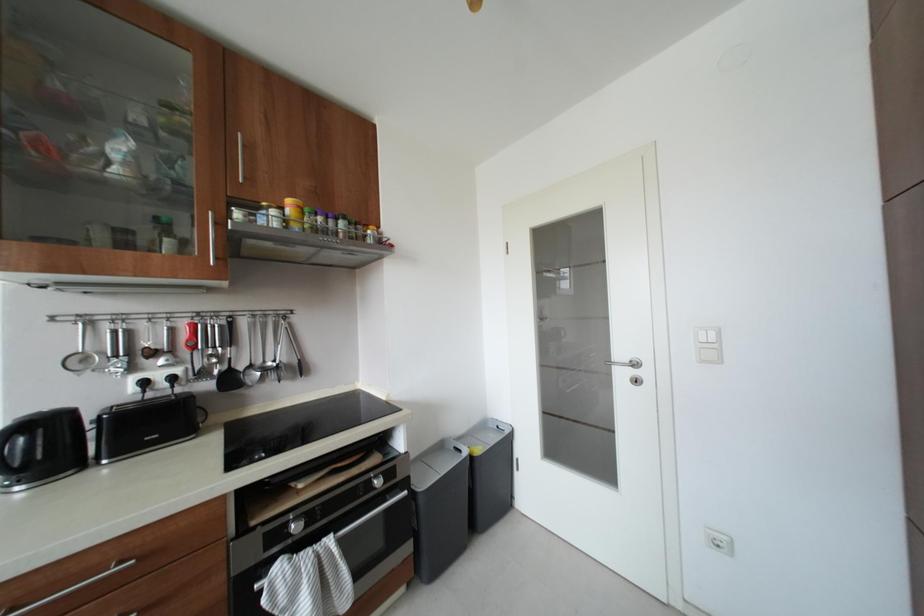
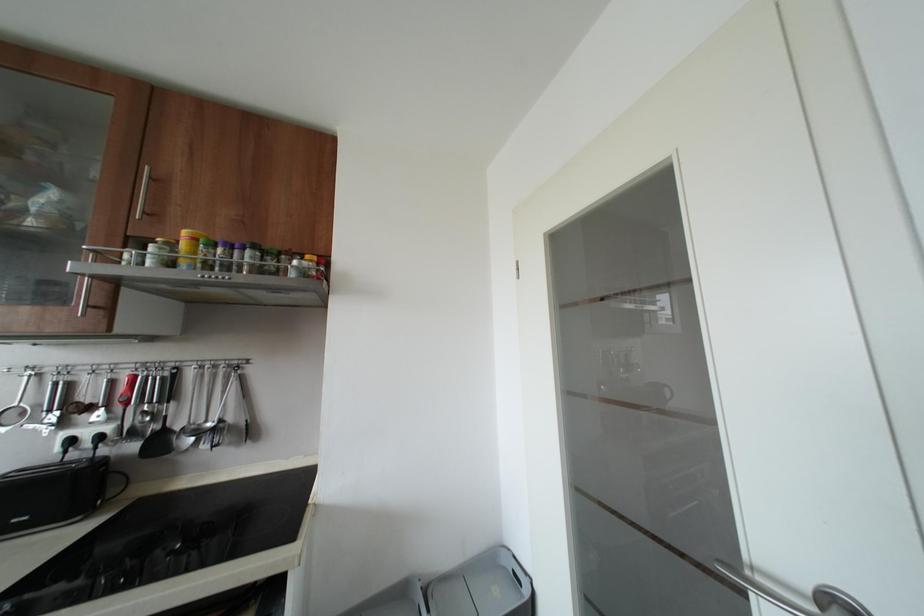
Which direction would the cameraman need to move to produce the second image?

The cameraman walked toward right, forward.